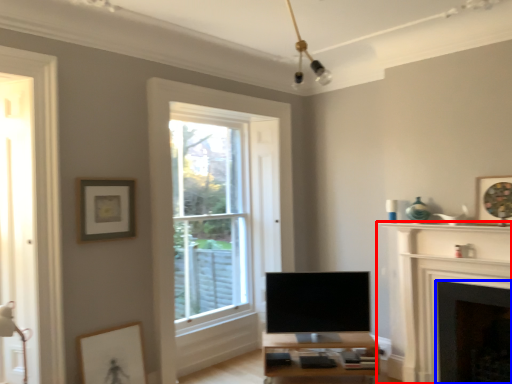
Question: Which object appears farthest to the camera in this image, fireplace (highlighted by a red box) or fireplace (highlighted by a blue box)?

Choices:
 (A) fireplace
 (B) fireplace

Answer: (B)